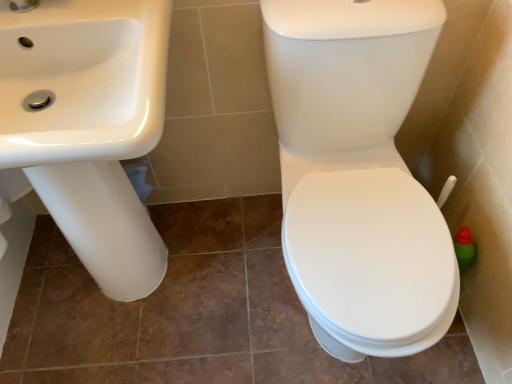
Question: Is white glossy sink at left positioned in front of white glossy toilet at right?

Choices:
 (A) yes
 (B) no

Answer: (B)

Question: Does white glossy sink at left have a lesser width compared to white glossy toilet at right?

Choices:
 (A) no
 (B) yes

Answer: (B)

Question: Can you see white glossy sink at left touching white glossy toilet at right?

Choices:
 (A) yes
 (B) no

Answer: (B)

Question: Could you tell me if white glossy sink at left is facing white glossy toilet at right?

Choices:
 (A) yes
 (B) no

Answer: (B)

Question: Is white glossy sink at left shorter than white glossy toilet at right?

Choices:
 (A) yes
 (B) no

Answer: (B)

Question: Is white glossy toilet at right inside white glossy sink at left?

Choices:
 (A) no
 (B) yes

Answer: (A)

Question: Considering the relative sizes of white glossy toilet at right and white glossy sink at left in the image provided, is white glossy toilet at right shorter than white glossy sink at left?

Choices:
 (A) no
 (B) yes

Answer: (B)

Question: Is white glossy toilet at right smaller than white glossy sink at left?

Choices:
 (A) yes
 (B) no

Answer: (B)

Question: From the image's perspective, is white glossy toilet at right located above white glossy sink at left?

Choices:
 (A) yes
 (B) no

Answer: (B)

Question: From a real-world perspective, is white glossy toilet at right over white glossy sink at left?

Choices:
 (A) no
 (B) yes

Answer: (A)

Question: Is white glossy toilet at right looking in the opposite direction of white glossy sink at left?

Choices:
 (A) no
 (B) yes

Answer: (A)

Question: Can you confirm if white glossy toilet at right is wider than white glossy sink at left?

Choices:
 (A) yes
 (B) no

Answer: (A)

Question: Would you say white glossy sink at left is to the left or to the right of white glossy toilet at right in the picture?

Choices:
 (A) left
 (B) right

Answer: (A)